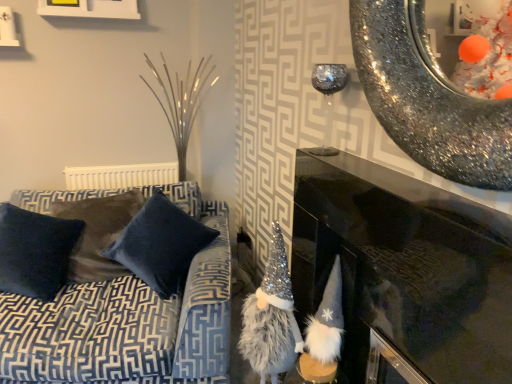
Question: Is white matte picture frame at upper left far away from white fluffy gnome at lower right?

Choices:
 (A) yes
 (B) no

Answer: (A)

Question: Is white matte picture frame at upper left taller than white fluffy gnome at lower right?

Choices:
 (A) no
 (B) yes

Answer: (A)

Question: Could you tell me if white matte picture frame at upper left is turned towards white fluffy gnome at lower right?

Choices:
 (A) yes
 (B) no

Answer: (B)

Question: Is white matte picture frame at upper left wider than white fluffy gnome at lower right?

Choices:
 (A) no
 (B) yes

Answer: (A)

Question: Considering the relative sizes of white matte picture frame at upper left and white fluffy gnome at lower right in the image provided, is white matte picture frame at upper left thinner than white fluffy gnome at lower right?

Choices:
 (A) no
 (B) yes

Answer: (B)

Question: Considering the relative sizes of white matte picture frame at upper left and white fluffy gnome at lower right in the image provided, is white matte picture frame at upper left smaller than white fluffy gnome at lower right?

Choices:
 (A) no
 (B) yes

Answer: (B)

Question: Is fuzzy silver gnome at center facing towards black glossy fireplace at center?

Choices:
 (A) no
 (B) yes

Answer: (B)

Question: Is black glossy fireplace at center at the back of fuzzy silver gnome at center?

Choices:
 (A) no
 (B) yes

Answer: (B)

Question: Can you confirm if fuzzy silver gnome at center is bigger than black glossy fireplace at center?

Choices:
 (A) yes
 (B) no

Answer: (B)

Question: From the image's perspective, does fuzzy silver gnome at center appear higher than black glossy fireplace at center?

Choices:
 (A) yes
 (B) no

Answer: (A)

Question: Does fuzzy silver gnome at center have a lesser height compared to black glossy fireplace at center?

Choices:
 (A) no
 (B) yes

Answer: (B)

Question: Is fuzzy silver gnome at center further to the viewer compared to black glossy fireplace at center?

Choices:
 (A) yes
 (B) no

Answer: (A)

Question: Considering the relative sizes of black glossy fireplace at center and velvet blue pillow at center, the 1th pillow positioned from the right, in the image provided, is black glossy fireplace at center shorter than velvet blue pillow at center, the 1th pillow positioned from the right,?

Choices:
 (A) yes
 (B) no

Answer: (B)